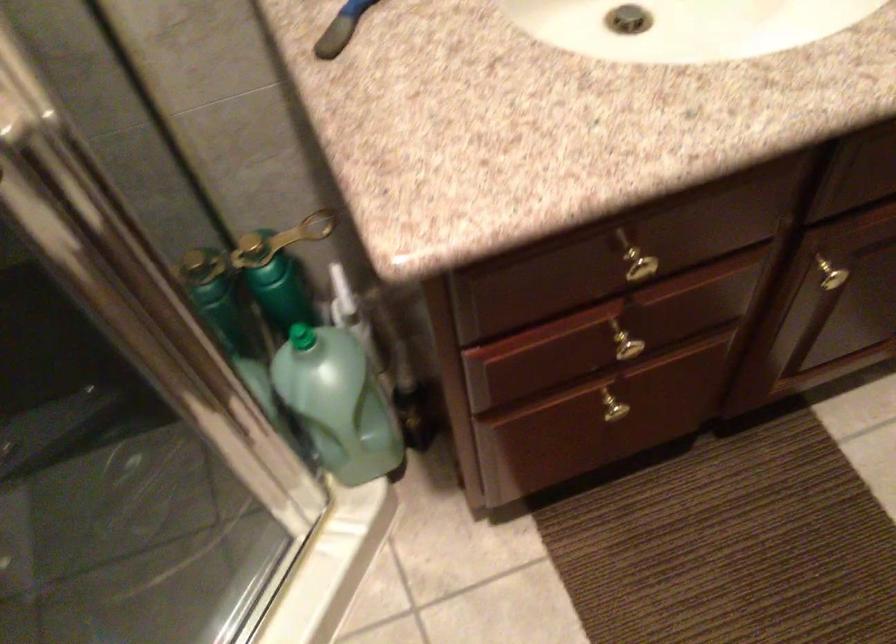
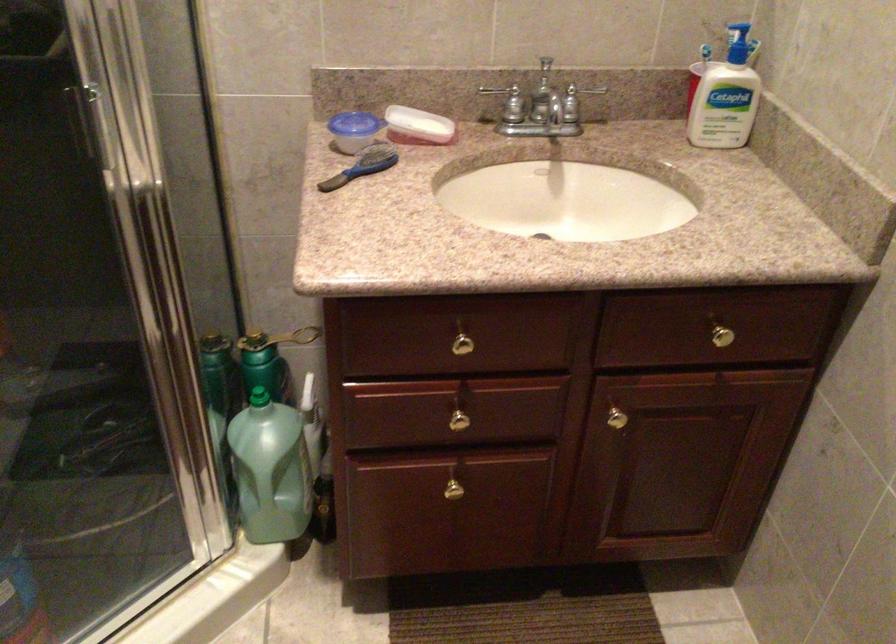
Where in the second image is the point corresponding to (815,263) from the first image?

(612, 411)